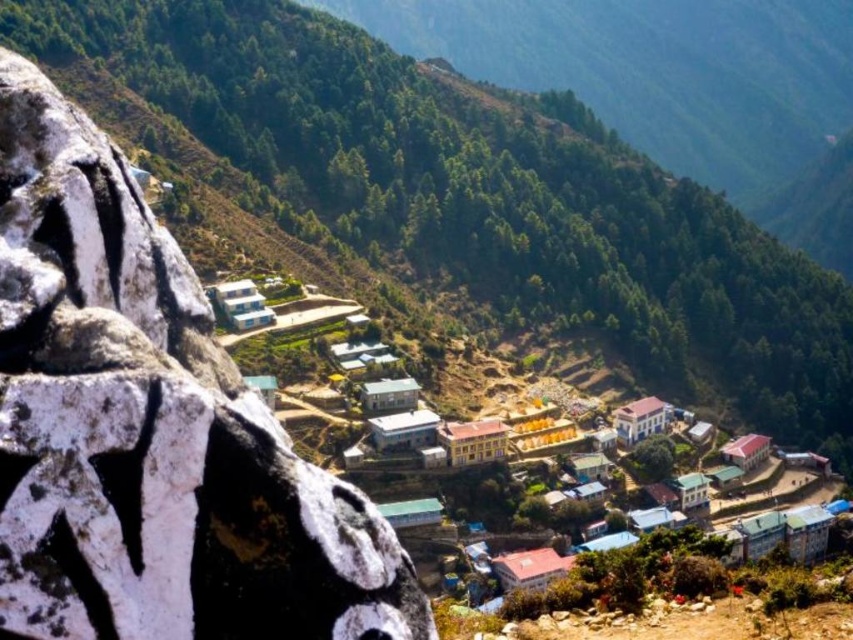
Is the position of green matte rock at left more distant than that of white matte building at center?

Yes, green matte rock at left is further from the viewer.

Can you confirm if green matte rock at left is wider than white matte building at center?

Indeed, green matte rock at left has a greater width compared to white matte building at center.

This screenshot has width=853, height=640. Describe the element at coordinates (482, 196) in the screenshot. I see `green matte rock at left` at that location.

Image resolution: width=853 pixels, height=640 pixels. I want to click on green matte rock at left, so click(x=482, y=196).

Does green matte rock at left appear over green forested hillside at upper center?

No, green matte rock at left is not above green forested hillside at upper center.

Identify the location of green matte rock at left. (482, 196).

Locate an element on the screen. green matte rock at left is located at coordinates (482, 196).

Between green matte rock at left and white textured rock at left, which one appears on the left side from the viewer's perspective?

From the viewer's perspective, white textured rock at left appears more on the left side.

Is point (213, 33) positioned after point (279, 508)?

Yes, it is.

In order to click on green matte rock at left in this screenshot , I will do `click(482, 196)`.